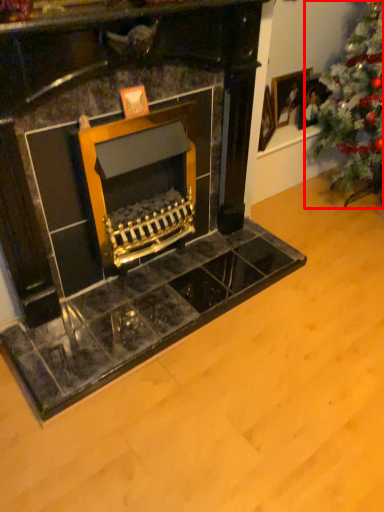
Question: From the image's perspective, considering the relative positions of christmas tree (annotated by the red box) and picture frame in the image provided, where is christmas tree (annotated by the red box) located with respect to the staircase?

Choices:
 (A) below
 (B) above

Answer: (A)